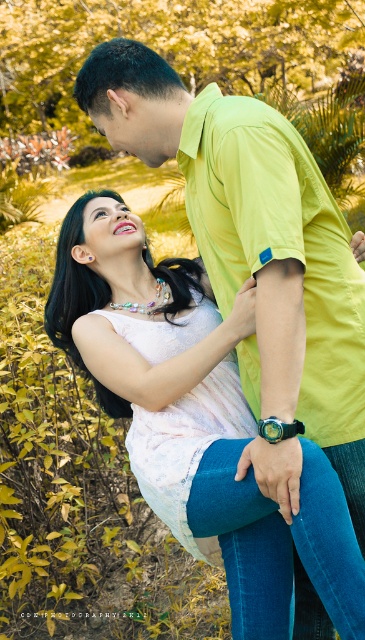
From the picture: Does matte white blouse at center appear under matte black forehead at upper center?

Yes, matte white blouse at center is below matte black forehead at upper center.

Does matte white blouse at center appear over matte black forehead at upper center?

No, matte white blouse at center is not above matte black forehead at upper center.

Is point (239, 419) farther from camera compared to point (100, 204)?

No.

This screenshot has width=365, height=640. What are the coordinates of `matte white blouse at center` in the screenshot? It's located at (133, 310).